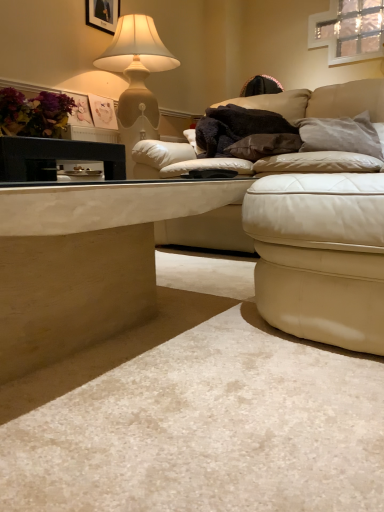
Question: In the image, is matte purple flowers at upper left positioned in front of or behind black fuzzy blanket at center?

Choices:
 (A) behind
 (B) front

Answer: (A)

Question: From a real-world perspective, is matte purple flowers at upper left positioned above or below black fuzzy blanket at center?

Choices:
 (A) below
 (B) above

Answer: (B)

Question: Which is nearer to the leather couch at upper right?

Choices:
 (A) leather ottoman at lower right
 (B) black matte picture frame at upper left
 (C) gray suede pillow at upper right, which is the first pillow from right to left
 (D) black glossy table at left, which is the 1th table from top to bottom
 (E) black fuzzy blanket at center

Answer: (A)

Question: Estimate the real-world distances between objects in this image. Which object is farther from the black matte picture frame at upper left?

Choices:
 (A) clear glass window at upper right
 (B) black fuzzy blanket at center
 (C) smooth beige table at lower left, acting as the 1th table starting from the bottom
 (D) matte purple flowers at upper left
 (E) matte beige lamp at upper left

Answer: (C)